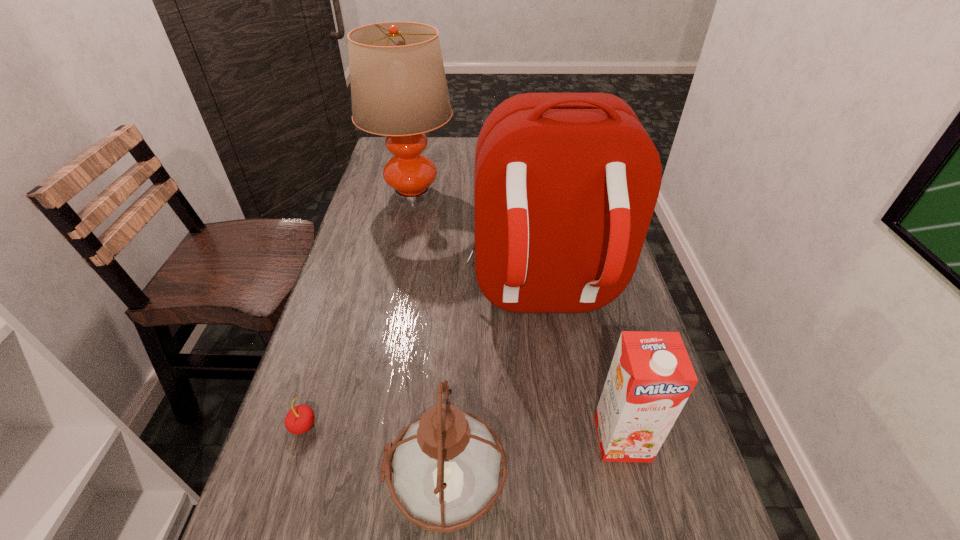
Find the location of a particular element. The width and height of the screenshot is (960, 540). the fourth nearest object is located at coordinates (566, 184).

The image size is (960, 540). I want to click on the farthest object, so click(x=398, y=84).

The image size is (960, 540). I want to click on carton, so click(x=651, y=377).

Where is `the shortest object`? The image size is (960, 540). the shortest object is located at coordinates (300, 419).

Identify the location of vacant space located on the strap side of the fourth nearest object. This screenshot has width=960, height=540. (577, 537).

What are the coordinates of `vacant space situated on the front of the farthest object` in the screenshot? It's located at (391, 297).

The height and width of the screenshot is (540, 960). Identify the location of free space located 0.330m on the left of the carton. (417, 438).

Where is `free space located on the right of the cherry`? The width and height of the screenshot is (960, 540). free space located on the right of the cherry is located at coordinates (456, 426).

I want to click on lamp present at the left edge, so click(398, 84).

Identify the location of cherry positioned at the left edge. (300, 419).